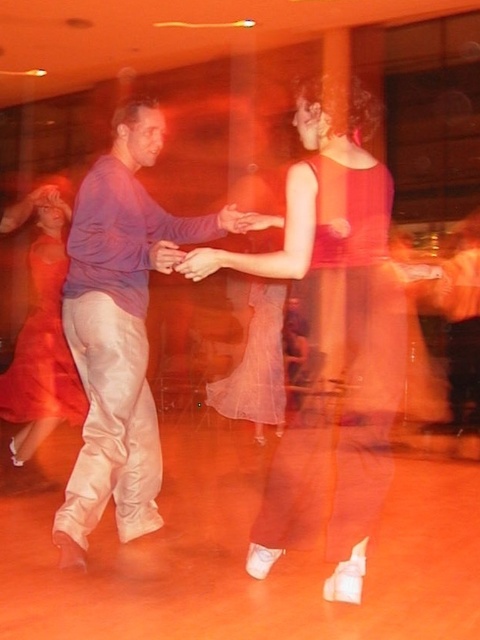
Question: Is matte red dress at center to the right of matte red dress at left from the viewer's perspective?

Choices:
 (A) yes
 (B) no

Answer: (A)

Question: Does matte purple shirt at left lie in front of translucent pink fabric at center?

Choices:
 (A) no
 (B) yes

Answer: (B)

Question: Is matte purple shirt at left smaller than translucent pink fabric at center?

Choices:
 (A) no
 (B) yes

Answer: (A)

Question: Which object is positioned farthest from the translucent pink fabric at center?

Choices:
 (A) matte purple shirt at left
 (B) matte skin hand at center
 (C) matte red dress at left
 (D) matte red dress at center

Answer: (B)

Question: Based on their relative distances, which object is nearer to the matte red dress at left?

Choices:
 (A) matte purple shirt at left
 (B) matte skin hand at center

Answer: (A)

Question: Which object is farther from the camera taking this photo?

Choices:
 (A) translucent pink fabric at center
 (B) matte red dress at center

Answer: (A)